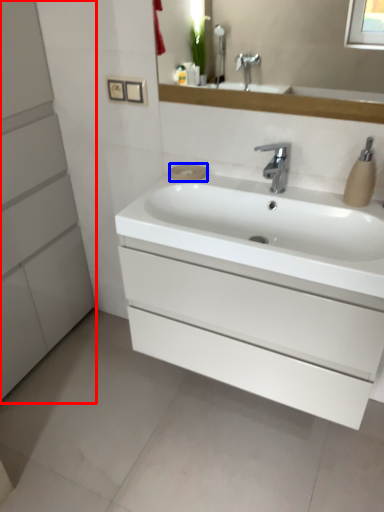
Question: Among these objects, which one is nearest to the camera, bathroom cabinet (highlighted by a red box) or soap (highlighted by a blue box)?

Choices:
 (A) bathroom cabinet
 (B) soap

Answer: (A)